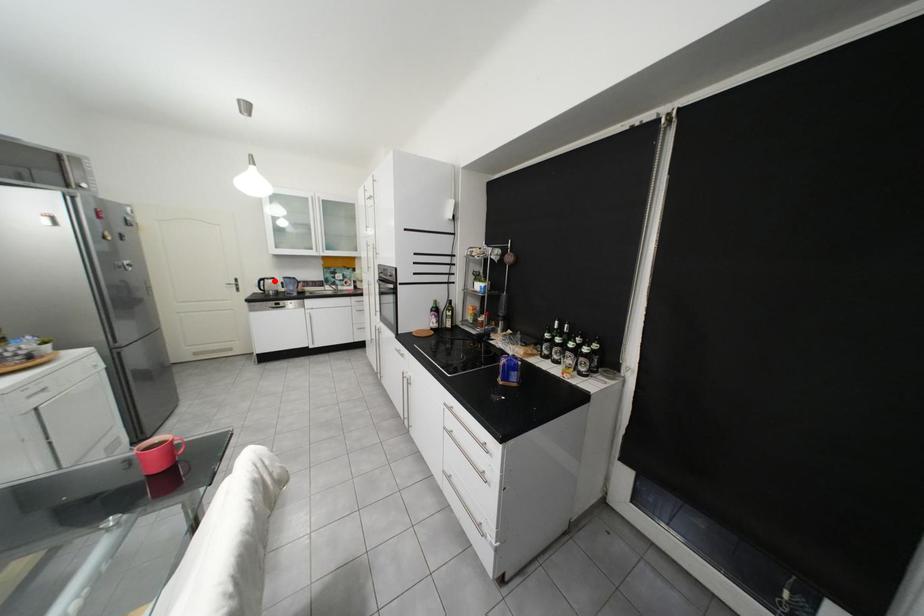
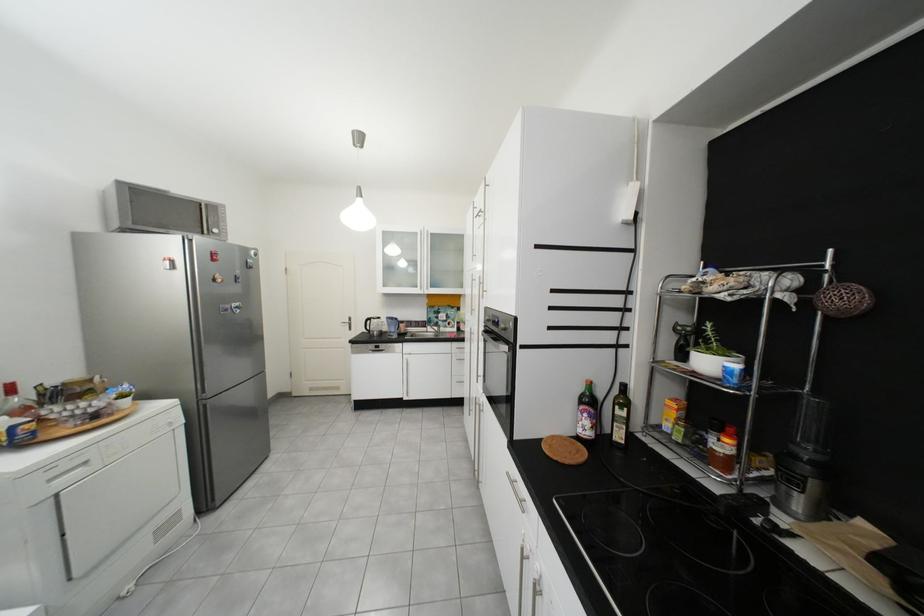
In the second image, find the point that corresponds to the highlighted location in the first image.

(381, 321)